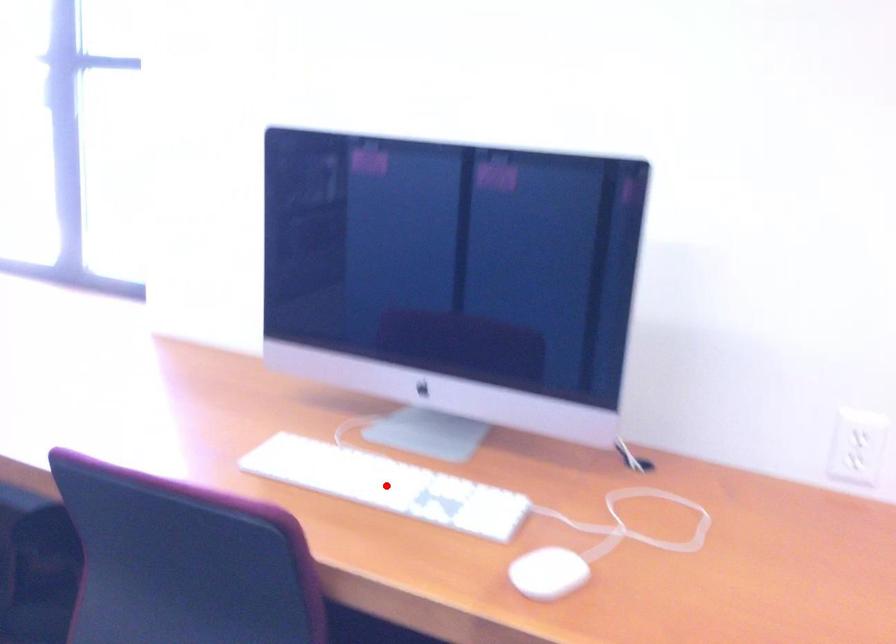
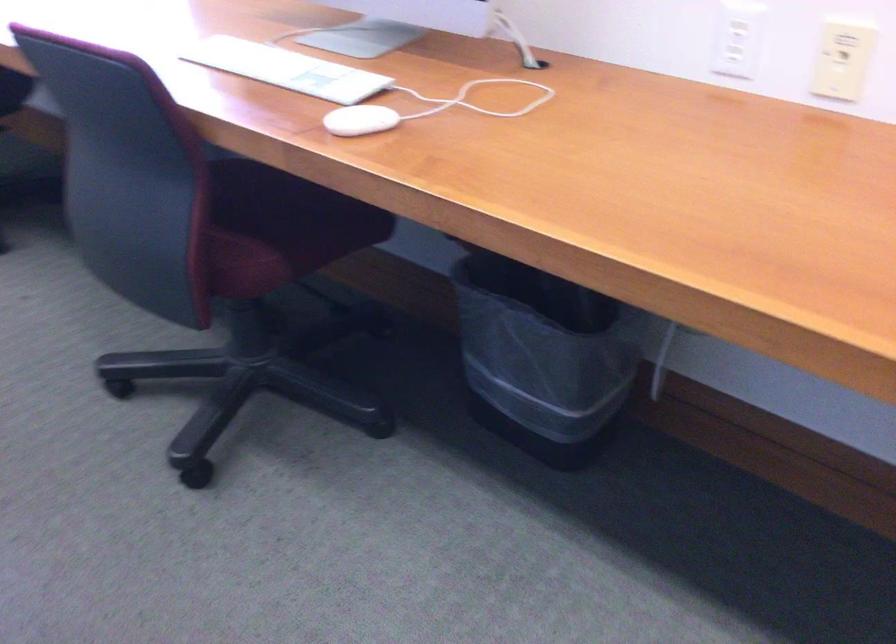
Question: I am providing you with two images of the same scene from different viewpoints. A red point is marked on the first image. Can you still see the location of the red point in image 2?

Choices:
 (A) Yes
 (B) No

Answer: (A)